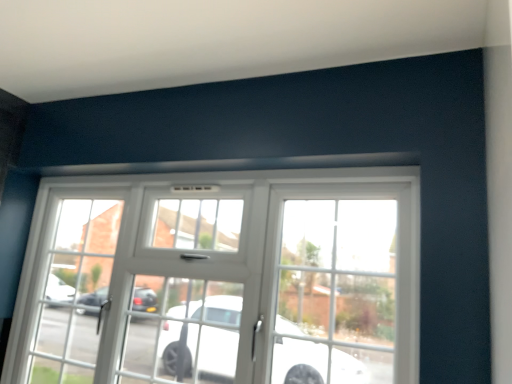
The width and height of the screenshot is (512, 384). What do you see at coordinates (222, 278) in the screenshot?
I see `white plastic window at center` at bounding box center [222, 278].

You are a GUI agent. You are given a task and a screenshot of the screen. Output one action in this format:
    pyautogui.click(x=<x>, y=<y>)
    Task: Click on the white plastic window at center
    
    Given the screenshot: What is the action you would take?
    [x=222, y=278]

Find the location of a particular element. white plastic window at center is located at coordinates tap(222, 278).